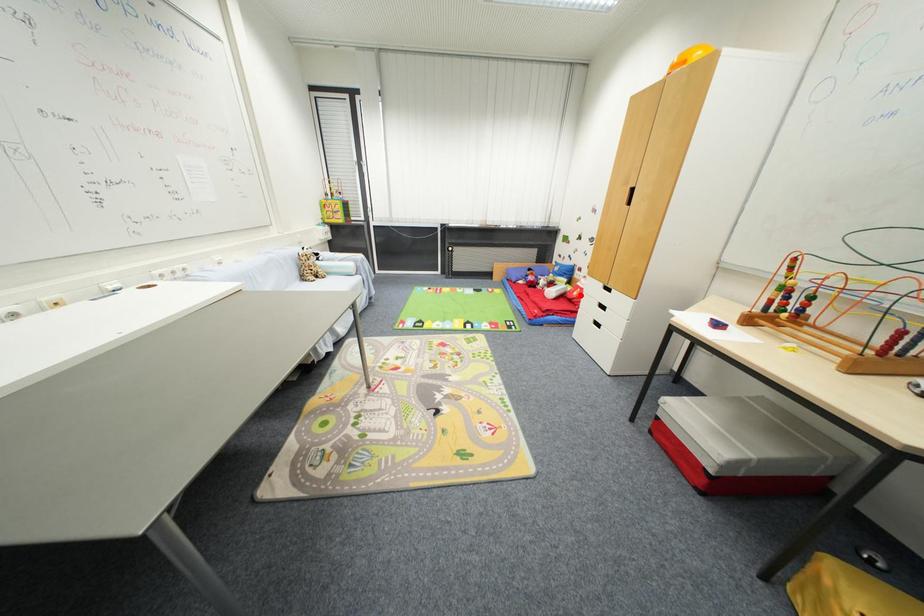
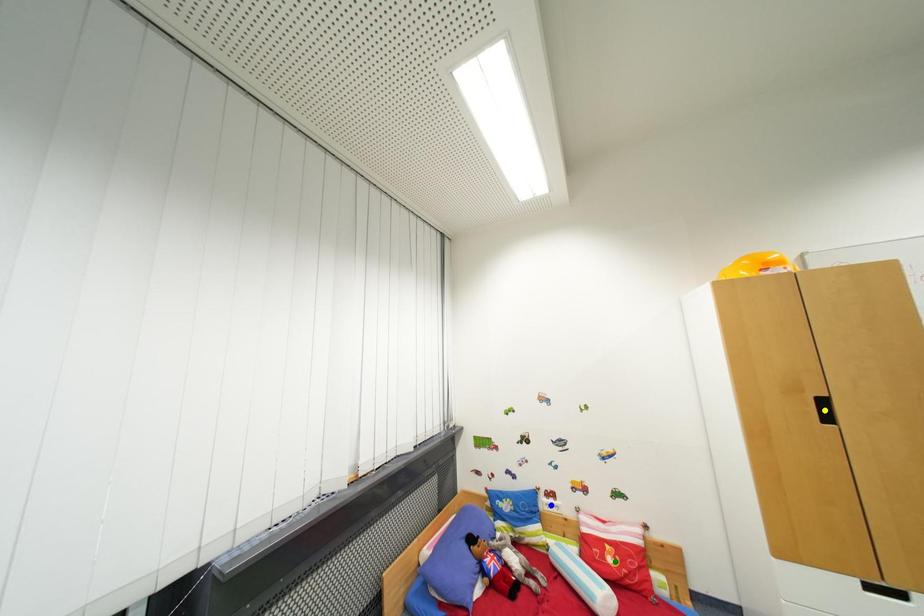
Question: I am providing you with two images of the same scene from different viewpoints. A red point is marked on the first image. You are given multiple points on the second image. Which point in image 2 is actually the same real-world point as the red point in image 1?

Choices:
 (A) green point
 (B) yellow point
 (C) blue point

Answer: (A)